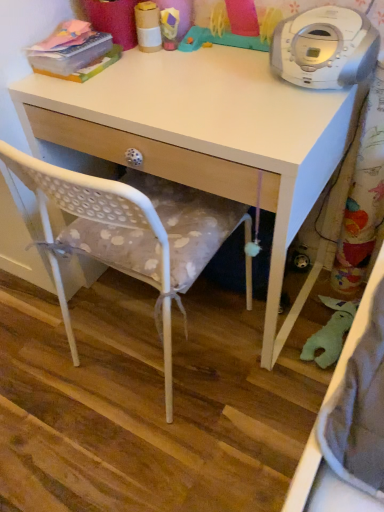
The width and height of the screenshot is (384, 512). What are the coordinates of `free area in between white matte desk at center and white polka dot fabric chair at center` in the screenshot? It's located at coord(152,354).